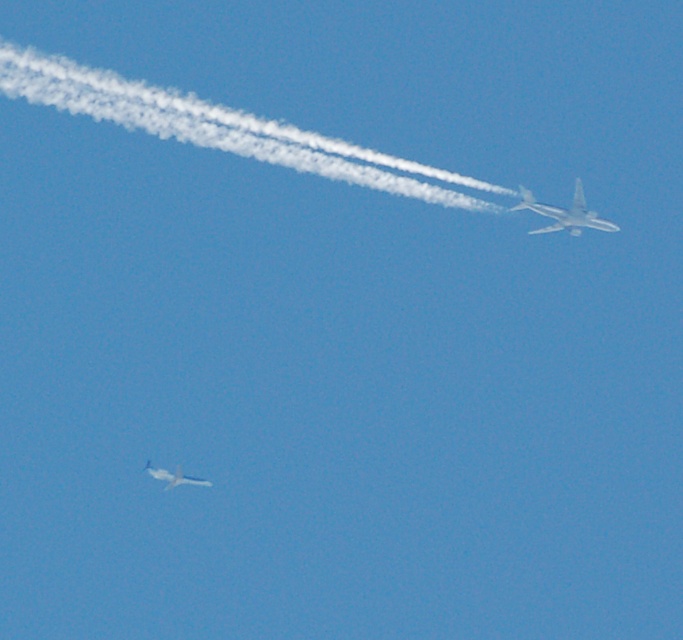
Does white glossy airplane at upper right have a greater width compared to metallic silver airplane at lower left?

Correct, the width of white glossy airplane at upper right exceeds that of metallic silver airplane at lower left.

Is white glossy airplane at upper right positioned in front of metallic silver airplane at lower left?

Yes, white glossy airplane at upper right is closer to the viewer.

Which is in front, point (581, 221) or point (154, 470)?

Point (581, 221) is in front.

Locate an element on the screen. This screenshot has height=640, width=683. white glossy airplane at upper right is located at coordinates (563, 212).

Is point (415, 166) in front of point (581, 212)?

Yes, it is.

Between white vapor trail at upper center and white glossy airplane at upper right, which one appears on the right side from the viewer's perspective?

Positioned to the right is white glossy airplane at upper right.

Does point (279, 161) come farther from viewer compared to point (579, 204)?

No, (279, 161) is closer to viewer.

At what (x,y) coordinates should I click in order to perform the action: click on white vapor trail at upper center. Please return your answer as a coordinate pair (x, y). The height and width of the screenshot is (640, 683). Looking at the image, I should click on (221, 128).

Does white vapor trail at upper center appear under metallic silver airplane at lower left?

Incorrect, white vapor trail at upper center is not positioned below metallic silver airplane at lower left.

Which is more to the right, white vapor trail at upper center or metallic silver airplane at lower left?

white vapor trail at upper center is more to the right.

Is point (335, 163) less distant than point (173, 481)?

Yes.

Identify the location of white vapor trail at upper center. (221, 128).